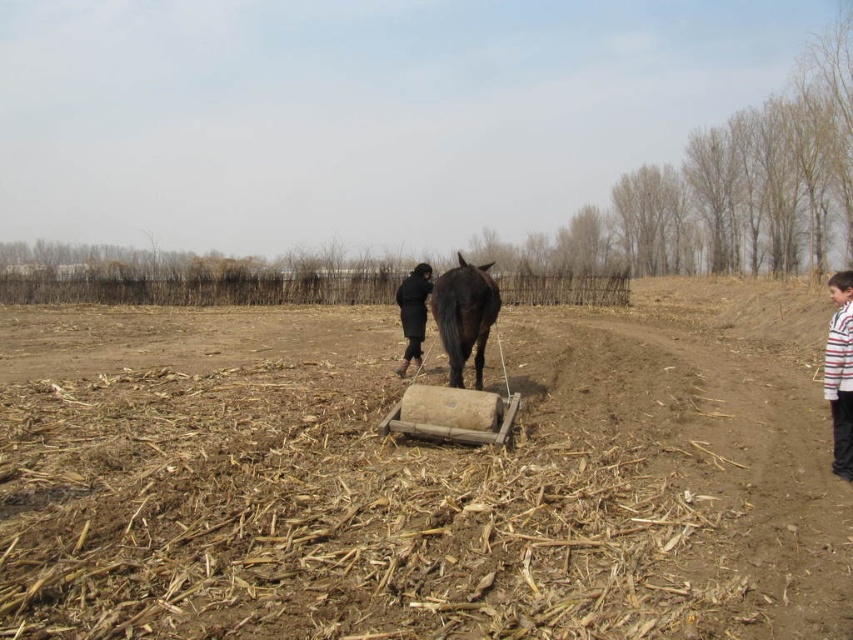
Question: Which point appears farthest from the camera in this image?

Choices:
 (A) (401, 372)
 (B) (509, 602)
 (C) (503, 438)
 (D) (834, 296)

Answer: (A)

Question: Does brown soil at center have a lesser width compared to wooden cart at center?

Choices:
 (A) yes
 (B) no

Answer: (B)

Question: Which object appears closest to the camera in this image?

Choices:
 (A) wooden cart at center
 (B) striped cotton shirt at right

Answer: (B)

Question: Is black glossy horse at center below black matte coat at center?

Choices:
 (A) no
 (B) yes

Answer: (A)

Question: Which point is closer to the camera?

Choices:
 (A) black matte coat at center
 (B) brown soil at center
 (C) striped cotton shirt at right
 (D) wooden cart at center

Answer: (B)

Question: Is black glossy horse at center above black matte coat at center?

Choices:
 (A) yes
 (B) no

Answer: (A)